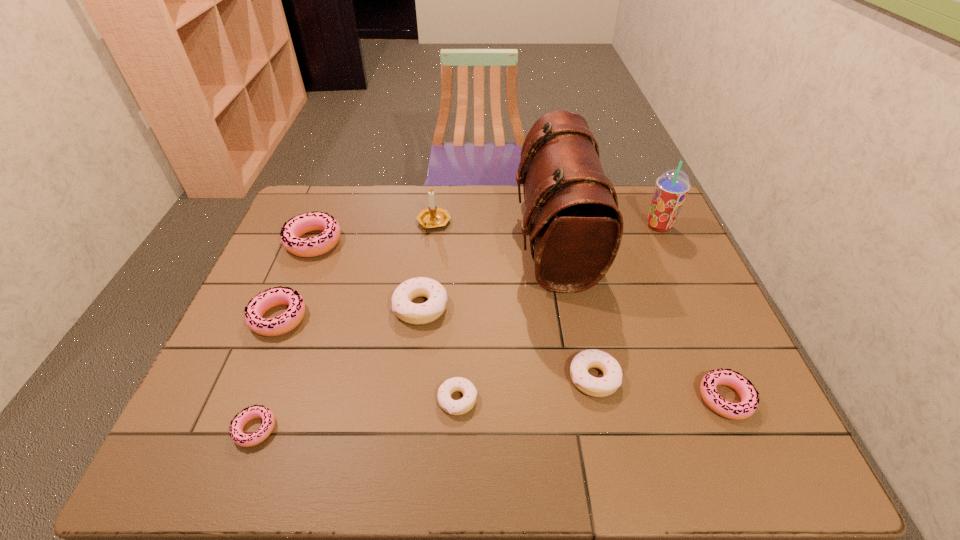
Find the location of a particular element. The image size is (960, 540). satchel is located at coordinates (572, 218).

The width and height of the screenshot is (960, 540). In order to click on brown satchel in this screenshot , I will do `click(572, 218)`.

Identify the location of the second tallest object. (672, 187).

You are a GUI agent. You are given a task and a screenshot of the screen. Output one action in this format:
    pyautogui.click(x=<x>, y=<y>)
    Task: Click on the eighth shortest object
    The height and width of the screenshot is (540, 960).
    Given the screenshot: What is the action you would take?
    pyautogui.click(x=432, y=217)

The height and width of the screenshot is (540, 960). What are the coordinates of `candle holder` in the screenshot? It's located at (432, 217).

Locate an element on the screen. Image resolution: width=960 pixels, height=540 pixels. the farthest pink doughnut is located at coordinates pyautogui.click(x=315, y=221).

Find the location of a particular element. This screenshot has height=540, width=960. the farthest doughnut is located at coordinates (315, 221).

The image size is (960, 540). I want to click on the biggest white doughnut, so click(x=417, y=314).

Where is `the third smallest pink doughnut`? The width and height of the screenshot is (960, 540). the third smallest pink doughnut is located at coordinates (260, 304).

At what (x,y) coordinates should I click in order to perform the action: click on the rightmost white doughnut. Please return your answer as a coordinate pair (x, y). Looking at the image, I should click on (597, 387).